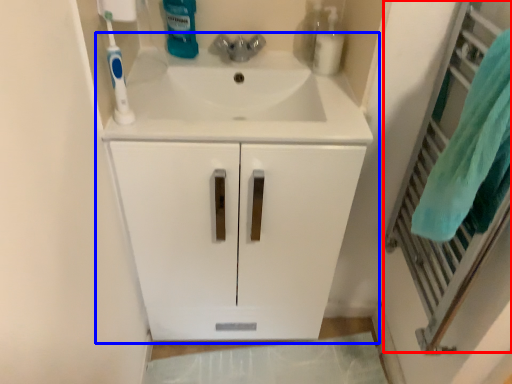
Question: Which object appears closest to the camera in this image, screen door (highlighted by a red box) or bathroom cabinet (highlighted by a blue box)?

Choices:
 (A) screen door
 (B) bathroom cabinet

Answer: (A)